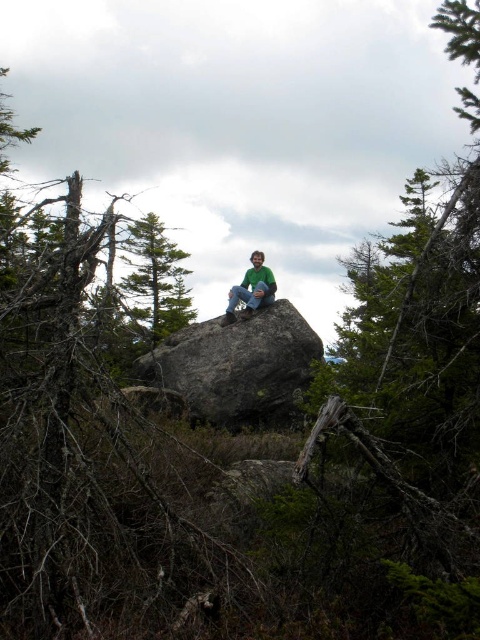
Consider the image. You are standing in the forest scene and want to place a small flag at point A and point B. Point A is at coordinates point (46,225) and point B is at coordinates point (257,304). Which point is closer to you?

Point A at coordinates point (46,225) is closer to you because it is further to the camera than point B at coordinates point (257,304).

Looking at this image, you are planning to take a photo of the brown bark tree at center and the gray rough boulder at center. Which object should you focus on first if you want to capture both in the same frame without moving the camera?

You should focus on the brown bark tree at center first because it is larger in size compared to the gray rough boulder at center, making it more prominent in the frame.

You are standing at the center of the image and want to find the gray rough boulder at center. In which direction should you look?

You should look towards the center of the image to find the gray rough boulder at center, as it is located at point (237, 365).